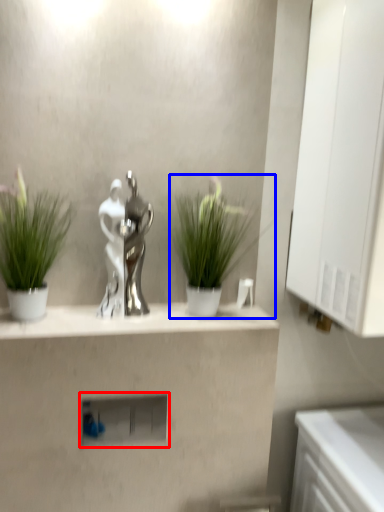
Question: Which point is further to the camera, shelf (highlighted by a red box) or houseplant (highlighted by a blue box)?

Choices:
 (A) shelf
 (B) houseplant

Answer: (A)